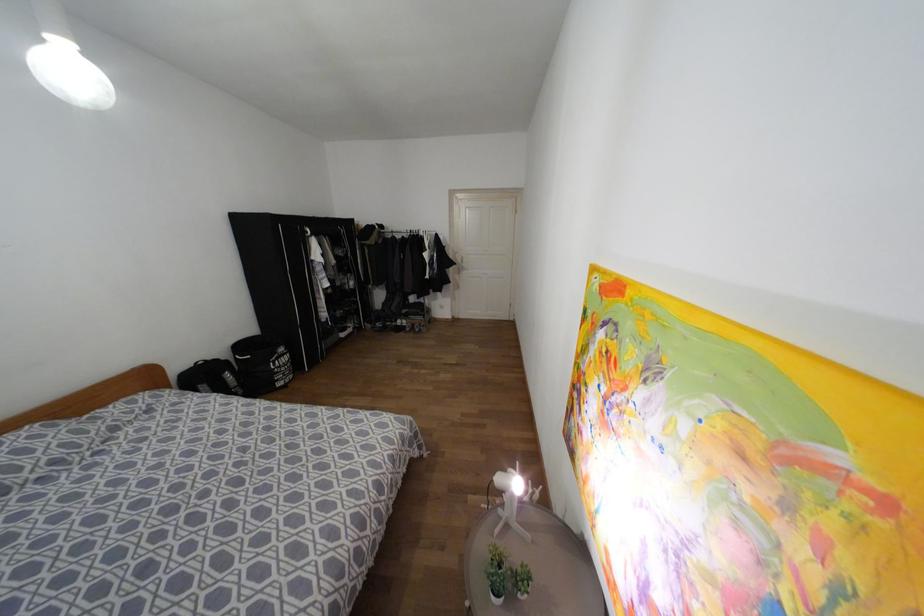
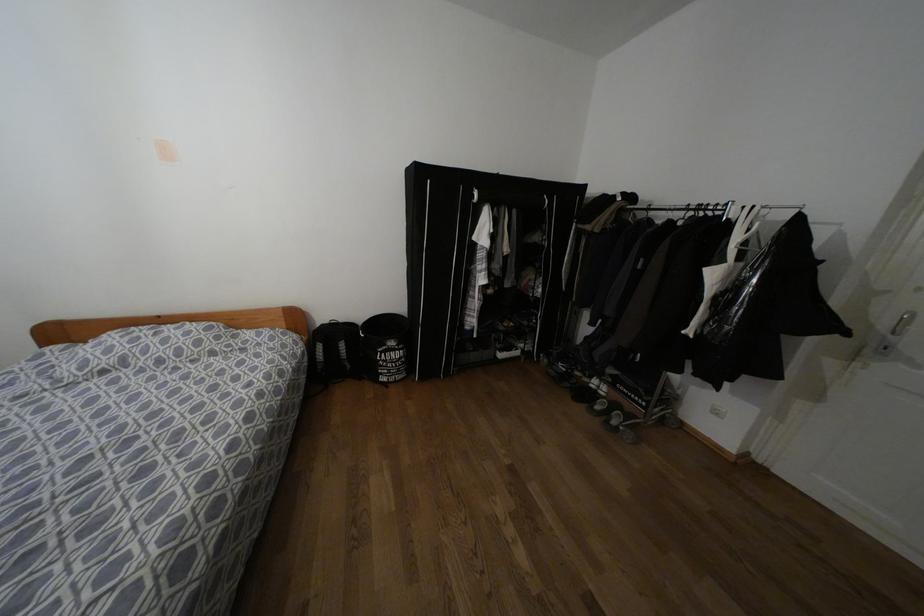
Locate, in the second image, the point that corresponds to (281,349) in the first image.

(391, 342)